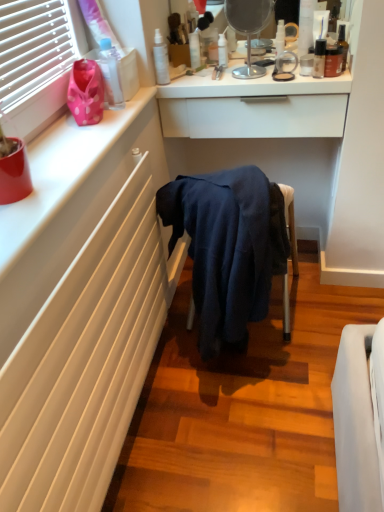
You are a GUI agent. You are given a task and a screenshot of the screen. Output one action in this format:
    pyautogui.click(x=<x>, y=<y>)
    Task: Click on the vacant area on top of white glossy drawer at upper center (from a real-world perspective)
    
    Given the screenshot: What is the action you would take?
    pyautogui.click(x=256, y=70)